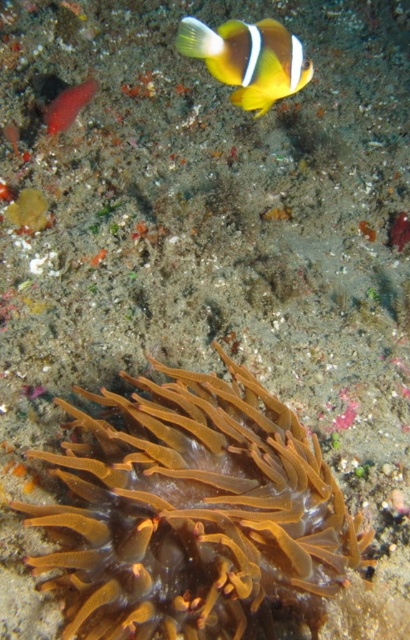
You are a marine biologist studying underwater life. You observe a point at coordinates [193,509] in the image. Based on the scene description, what organism is located at this point?

The point [193,509] indicates the orange translucent anemone at bottom.

You are a marine biologist observing the underwater scene. You notice the yellow matte clownfish at upper center and the smooth pinkish coral at upper left. Based on their positions, which object is located higher in the image?

The smooth pinkish coral at upper left is higher in the image because the yellow matte clownfish at upper center is positioned below it.